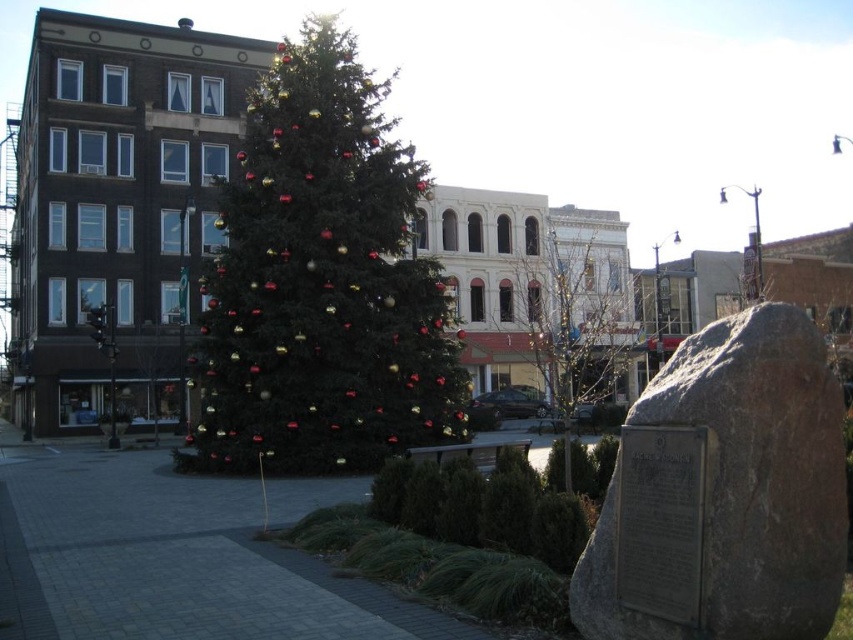
You are standing in the plaza and see the green matte christmas tree at center and the gray rock at center. Which object is located to the left of the other?

The green matte christmas tree at center is positioned on the left side of gray rock at center.

You are standing in the plaza looking at the Christmas tree and the building to its left. There are two points marked in the scene. Which point is closer to you, the point at coordinates point (x=412, y=196) or the point at coordinates point (x=757, y=467)?

The point at coordinates point (x=412, y=196) is closer to you because it is further to the viewer than the point at coordinates point (x=757, y=467).

You are organizing a Christmas event and need to place a large gift box between the green matte christmas tree at center and the green textured tree at center. Which tree should you position the gift box closer to if you want to maximize the available space around it?

The green textured tree at center occupies more space than the green matte christmas tree at center, so positioning the gift box closer to the green textured tree at center would allow for more space around it.